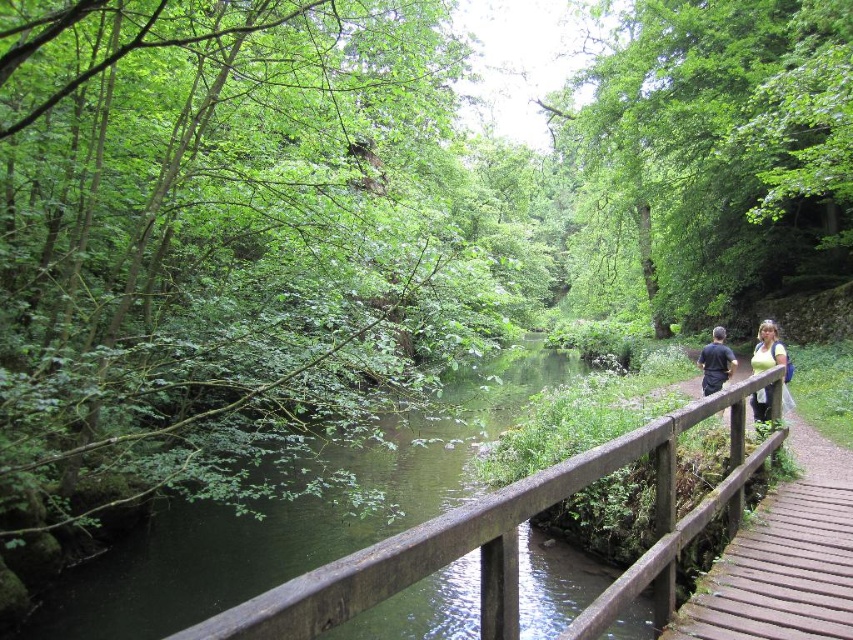
From the picture: Does brown wooden bridge at center appear over green fabric shirt at right?

No, brown wooden bridge at center is not above green fabric shirt at right.

Is brown wooden bridge at center closer to camera compared to green fabric shirt at right?

That is True.

Where is `brown wooden bridge at center`? Image resolution: width=853 pixels, height=640 pixels. brown wooden bridge at center is located at coordinates (515, 538).

You are a GUI agent. You are given a task and a screenshot of the screen. Output one action in this format:
    pyautogui.click(x=<x>, y=<y>)
    Task: Click on the brown wooden bridge at center
    Image resolution: width=853 pixels, height=640 pixels.
    Given the screenshot: What is the action you would take?
    pyautogui.click(x=515, y=538)

Between point (195, 636) and point (784, 355), which one is positioned in front?

Positioned in front is point (195, 636).

Does point (440, 547) come closer to viewer compared to point (758, 369)?

That is True.

At what (x,y) coordinates should I click in order to perform the action: click on brown wooden bridge at center. Please return your answer as a coordinate pair (x, y). Looking at the image, I should click on (515, 538).

Who is more forward, (358, 568) or (711, 388)?

Point (358, 568) is in front.

Between brown wooden bridge at center and dark blue shirt at center-right, which one has less height?

brown wooden bridge at center

You are a GUI agent. You are given a task and a screenshot of the screen. Output one action in this format:
    pyautogui.click(x=<x>, y=<y>)
    Task: Click on the brown wooden bridge at center
    Image resolution: width=853 pixels, height=640 pixels.
    Given the screenshot: What is the action you would take?
    pyautogui.click(x=515, y=538)